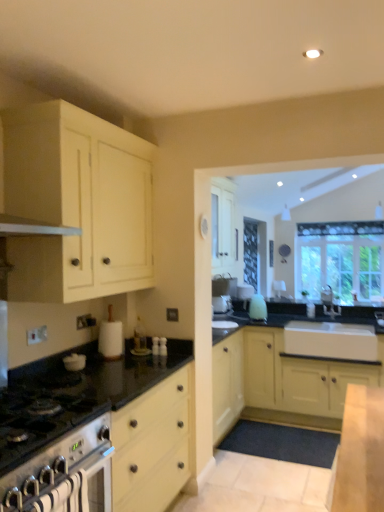
Question: Considering the relative sizes of white glossy kettle at lower left, which is counted as the 2th appliance, starting from the back, and clear glass window at upper right in the image provided, is white glossy kettle at lower left, which is counted as the 2th appliance, starting from the back, wider than clear glass window at upper right?

Choices:
 (A) yes
 (B) no

Answer: (B)

Question: From the image's perspective, is white glossy kettle at lower left, which is the first appliance in left-to-right order, above clear glass window at upper right?

Choices:
 (A) yes
 (B) no

Answer: (B)

Question: Does white glossy kettle at lower left, positioned as the first appliance in front-to-back order, have a larger size compared to clear glass window at upper right?

Choices:
 (A) no
 (B) yes

Answer: (A)

Question: Is white glossy kettle at lower left, the 2th appliance when ordered from right to left, looking in the opposite direction of clear glass window at upper right?

Choices:
 (A) no
 (B) yes

Answer: (A)

Question: Is white glossy kettle at lower left, the 2th appliance when ordered from right to left, outside clear glass window at upper right?

Choices:
 (A) yes
 (B) no

Answer: (A)

Question: From the image's perspective, relative to stainless steel oven at lower left, is white matte paper towel holder at center, the 1th appliance in the right-to-left sequence, above or below?

Choices:
 (A) above
 (B) below

Answer: (A)

Question: Based on their sizes in the image, would you say white matte paper towel holder at center, the 1th appliance in the right-to-left sequence, is bigger or smaller than stainless steel oven at lower left?

Choices:
 (A) small
 (B) big

Answer: (A)

Question: Is point (110, 308) positioned closer to the camera than point (104, 430)?

Choices:
 (A) farther
 (B) closer

Answer: (A)

Question: Considering their positions, is white matte paper towel holder at center, the 1th appliance in the right-to-left sequence, located in front of or behind stainless steel oven at lower left?

Choices:
 (A) front
 (B) behind

Answer: (B)

Question: Is point (112, 352) closer or farther from the camera than point (69, 368)?

Choices:
 (A) farther
 (B) closer

Answer: (A)

Question: Considering the positions of white matte paper towel holder at center, positioned as the 1th appliance in back-to-front order, and white glossy kettle at lower left, the 2th appliance when ordered from right to left, in the image, is white matte paper towel holder at center, positioned as the 1th appliance in back-to-front order, taller or shorter than white glossy kettle at lower left, the 2th appliance when ordered from right to left,?

Choices:
 (A) tall
 (B) short

Answer: (A)

Question: Is white matte paper towel holder at center, which is the 2th appliance from front to back, wider or thinner than white glossy kettle at lower left, positioned as the first appliance in front-to-back order?

Choices:
 (A) wide
 (B) thin

Answer: (B)

Question: In the image, is white matte paper towel holder at center, the 1th appliance in the right-to-left sequence, on the left side or the right side of white glossy kettle at lower left, which is the first appliance in left-to-right order?

Choices:
 (A) left
 (B) right

Answer: (B)

Question: From the image's perspective, is clear glass window at upper right located above or below matte yellow cabinet at center, which is the first cabinetry in right-to-left order?

Choices:
 (A) above
 (B) below

Answer: (A)

Question: From a real-world perspective, relative to matte yellow cabinet at center, which is the first cabinetry in right-to-left order, is clear glass window at upper right vertically above or below?

Choices:
 (A) above
 (B) below

Answer: (A)